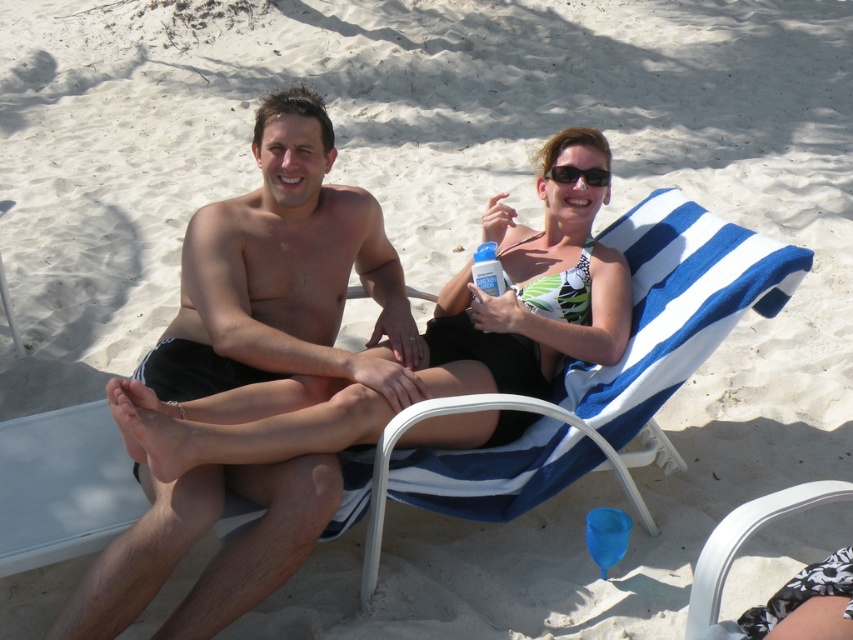
Between point (306, 445) and point (614, 237), which one is positioned in front?

Positioned in front is point (306, 445).

I want to click on green and white bikini top at center, so click(534, 289).

Which is behind, point (265, 428) or point (641, 250)?

The point (641, 250) is behind.

Image resolution: width=853 pixels, height=640 pixels. I want to click on green and white bikini top at center, so click(534, 289).

Can you confirm if blue striped beach chair at center is thinner than white plastic beach chair at lower right?

No.

Is blue striped beach chair at center smaller than white plastic beach chair at lower right?

No.

Identify the location of blue striped beach chair at center. This screenshot has width=853, height=640. (601, 368).

Can you confirm if black matte shorts at center is smaller than green and white bikini top at center?

Indeed, black matte shorts at center has a smaller size compared to green and white bikini top at center.

Which is below, black matte shorts at center or green and white bikini top at center?

black matte shorts at center is below.

Which is behind, point (303, 97) or point (148, 403)?

Point (303, 97)

Image resolution: width=853 pixels, height=640 pixels. What are the coordinates of `black matte shorts at center` in the screenshot? It's located at (283, 275).